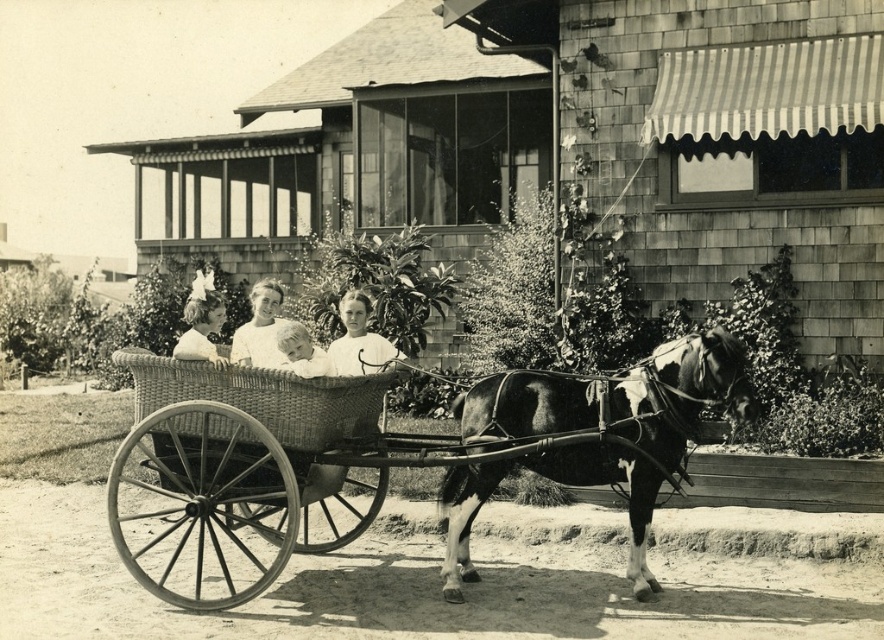
You are a photographer who wants to capture the black and white horse at center and the woven wicker basket at center in a single shot. Based on their heights, which object should you focus on first to ensure both are in frame?

The black and white horse at center is taller than the woven wicker basket at center, so you should focus on the black and white horse at center first to ensure both are in frame.

You are a photographer analyzing this vintage scene. You notice the black and white horse at center and the smooth white shirt at center. Based on their positions, which one is closer to the camera?

The black and white horse at center is closer to the camera because it is positioned in front of the smooth white shirt at center.